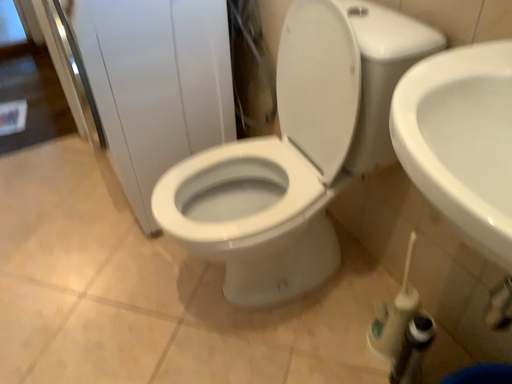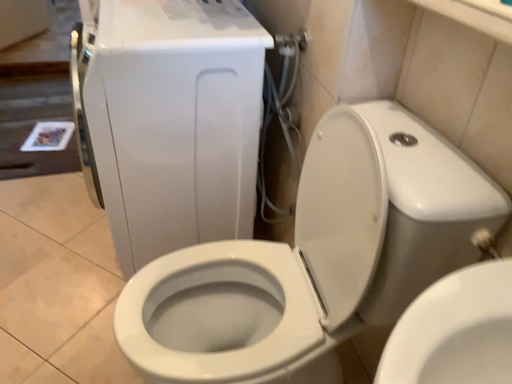
Question: How did the camera likely rotate when shooting the video?

Choices:
 (A) rotated right
 (B) rotated left

Answer: (B)